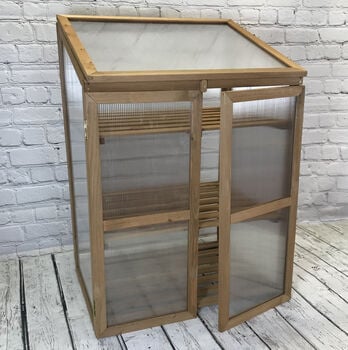
Identify the location of hinges on left door. Image resolution: width=348 pixels, height=350 pixels. (92, 307), (84, 133).